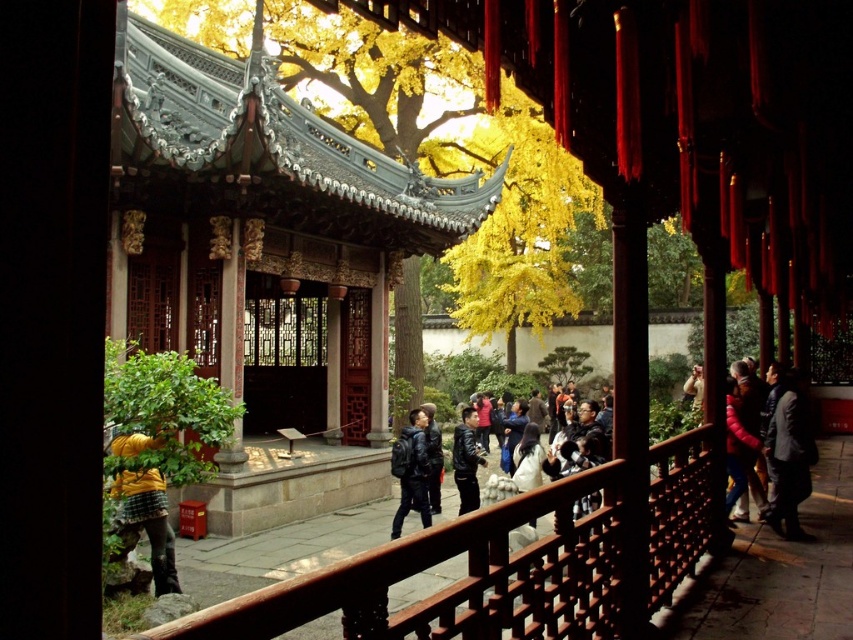
You are standing at the entrance of the pavilion and see two points marked in the scene. The first point is at coordinates point [303,586] and the second is at point [785,392]. Which point is closer to your current position?

Point [303,586] is closer to the camera than point [785,392], so the first point is closer to your current position.

You are a visitor standing at the entrance of the pavilion and want to place a small potted plant between the dark gray wool coat at lower right and the yellow matte jacket at lower left. Considering their heights, which object should the plant be placed closer to?

The dark gray wool coat at lower right is much taller than the yellow matte jacket at lower left. To ensure the plant is visible from both sides, it should be placed closer to the shorter yellow matte jacket at lower left.